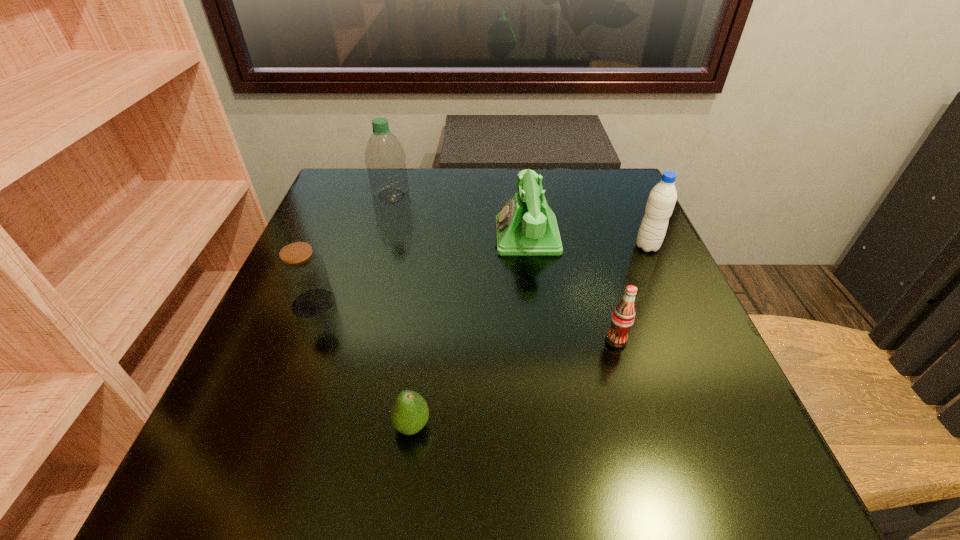
The image size is (960, 540). What are the coordinates of `telephone located at the far edge` in the screenshot? It's located at (526, 225).

The height and width of the screenshot is (540, 960). Find the location of `water bottle situated at the left edge`. water bottle situated at the left edge is located at coordinates (385, 159).

This screenshot has width=960, height=540. In order to click on jar located in the left edge section of the desktop in this screenshot , I will do `click(303, 274)`.

You are a GUI agent. You are given a task and a screenshot of the screen. Output one action in this format:
    pyautogui.click(x=<x>, y=<y>)
    Task: Click on the water bottle that is at the right edge
    
    Given the screenshot: What is the action you would take?
    pyautogui.click(x=662, y=198)

Image resolution: width=960 pixels, height=540 pixels. I want to click on soda at the right edge, so click(622, 319).

You are a GUI agent. You are given a task and a screenshot of the screen. Output one action in this format:
    pyautogui.click(x=<x>, y=<y>)
    Task: Click on the object that is positioned at the far left corner
    The image size is (960, 540).
    Given the screenshot: What is the action you would take?
    pyautogui.click(x=385, y=159)

The width and height of the screenshot is (960, 540). Find the location of `free region at the far edge of the desktop`. free region at the far edge of the desktop is located at coordinates (466, 215).

Locate an element on the screen. free region at the near edge of the desktop is located at coordinates (327, 514).

Where is `vacant space at the right edge`? The width and height of the screenshot is (960, 540). vacant space at the right edge is located at coordinates (633, 238).

This screenshot has height=540, width=960. I want to click on free space at the far left corner, so click(367, 180).